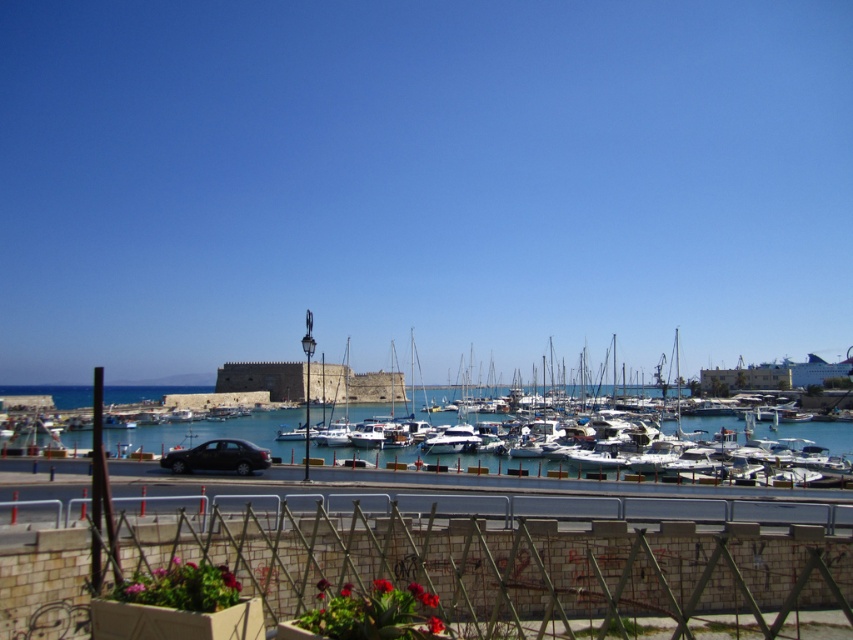
Can you confirm if brick wall at lower center is smaller than white glossy boat at center?

Yes, brick wall at lower center is smaller than white glossy boat at center.

Between brick wall at lower center and white glossy boat at center, which one has less height?

Standing shorter between the two is brick wall at lower center.

The width and height of the screenshot is (853, 640). Identify the location of brick wall at lower center. (506, 563).

Between blue water at center and white glossy boat at center, which one appears on the left side from the viewer's perspective?

blue water at center

Image resolution: width=853 pixels, height=640 pixels. In order to click on blue water at center in this screenshot , I will do `click(212, 433)`.

Is brick wall at lower center thinner than blue water at center?

Result: Correct, brick wall at lower center's width is less than blue water at center's.

Is point (28, 604) positioned in front of point (300, 451)?

Yes.

Identify the location of brick wall at lower center. (506, 563).